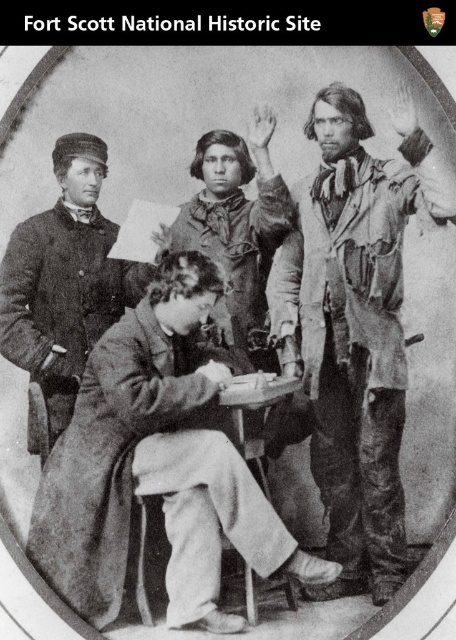
Looking at the historical photograph from Fort Scott National Historic Site, you notice two garments worn by the individuals in the image. The coarse woolen coat at center and the ragged fabric shirt at right. Which garment has a wider width?

The coarse woolen coat at center has a larger width than the ragged fabric shirt at right.

You are an observer looking at the historical photograph from Fort Scott National Historic Site. You notice two items of clothing in the image. The first is the ragged fabric shirt at right, and the second is the smooth leather jacket at center. Which of these two items is positioned farther to the east in the photograph?

The ragged fabric shirt at right is positioned to the right of the smooth leather jacket at center, so it is farther to the east in the photograph.

Looking at the historical photograph from Fort Scott National Historic Site, you notice two shirts in the image. The ragged fabric shirt at right and the worn fabric shirt at center. Which of these shirts is bigger in size?

A: The ragged fabric shirt at right is larger in size compared to the worn fabric shirt at center.